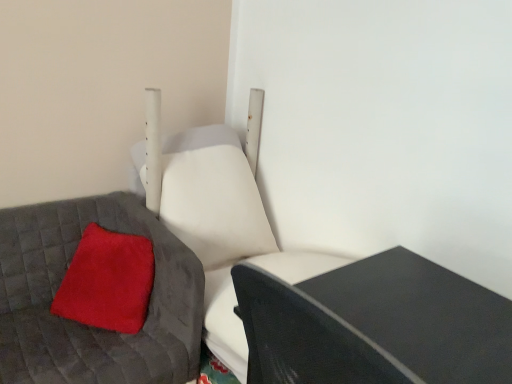
Question: Considering the relative sizes of velvety red pillow at left and white leather swivel chair at center in the image provided, is velvety red pillow at left smaller than white leather swivel chair at center?

Choices:
 (A) no
 (B) yes

Answer: (B)

Question: Is velvety red pillow at left not close to white leather swivel chair at center?

Choices:
 (A) no
 (B) yes

Answer: (A)

Question: Are velvety red pillow at left and white leather swivel chair at center beside each other?

Choices:
 (A) yes
 (B) no

Answer: (B)

Question: Is white leather swivel chair at center a part of velvety red pillow at left?

Choices:
 (A) yes
 (B) no

Answer: (B)

Question: Is velvety red pillow at left to the right of white leather swivel chair at center from the viewer's perspective?

Choices:
 (A) yes
 (B) no

Answer: (B)

Question: Is point (108, 251) closer or farther from the camera than point (227, 208)?

Choices:
 (A) farther
 (B) closer

Answer: (B)

Question: In terms of height, does fuzzy red pillow at lower left look taller or shorter compared to white leather swivel chair at center?

Choices:
 (A) tall
 (B) short

Answer: (B)

Question: Looking at their shapes, would you say fuzzy red pillow at lower left is wider or thinner than white leather swivel chair at center?

Choices:
 (A) wide
 (B) thin

Answer: (B)

Question: From a real-world perspective, is fuzzy red pillow at lower left physically located above or below white leather swivel chair at center?

Choices:
 (A) above
 (B) below

Answer: (B)

Question: Is fuzzy red pillow at lower left wider or thinner than black matte table at lower right?

Choices:
 (A) thin
 (B) wide

Answer: (A)

Question: Considering the positions of fuzzy red pillow at lower left and black matte table at lower right in the image, is fuzzy red pillow at lower left bigger or smaller than black matte table at lower right?

Choices:
 (A) big
 (B) small

Answer: (B)

Question: From the image's perspective, is fuzzy red pillow at lower left positioned above or below black matte table at lower right?

Choices:
 (A) above
 (B) below

Answer: (A)

Question: Considering the positions of fuzzy red pillow at lower left and black matte table at lower right in the image, is fuzzy red pillow at lower left taller or shorter than black matte table at lower right?

Choices:
 (A) tall
 (B) short

Answer: (B)

Question: Looking at their shapes, would you say black matte table at lower right is wider or thinner than fuzzy red pillow at lower left?

Choices:
 (A) thin
 (B) wide

Answer: (B)

Question: From a real-world perspective, is black matte table at lower right positioned above or below fuzzy red pillow at lower left?

Choices:
 (A) above
 (B) below

Answer: (B)